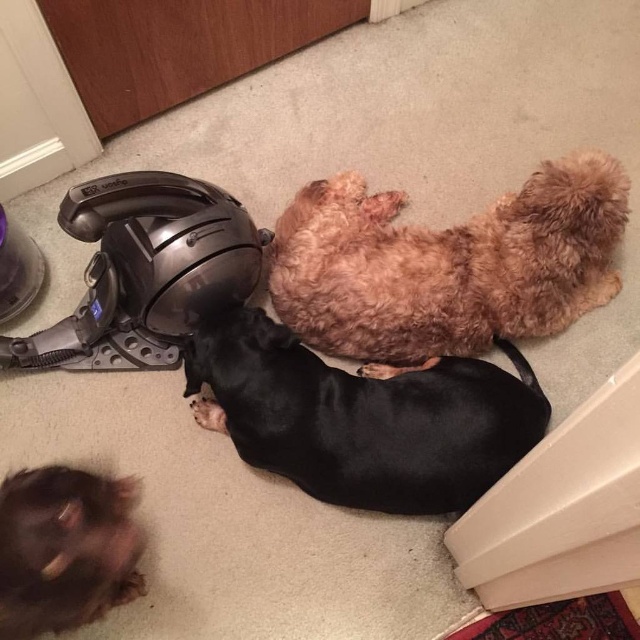
Is black smooth dog at center positioned at the back of brown fluffy dog at lower left?

That is True.

Is black smooth dog at center bigger than brown fluffy dog at lower left?

Yes, black smooth dog at center is bigger than brown fluffy dog at lower left.

Between point (275, 330) and point (35, 547), which one is positioned in front?

Point (35, 547) is in front.

You are a GUI agent. You are given a task and a screenshot of the screen. Output one action in this format:
    pyautogui.click(x=<x>, y=<y>)
    Task: Click on the black smooth dog at center
    The height and width of the screenshot is (640, 640).
    Given the screenshot: What is the action you would take?
    pyautogui.click(x=362, y=417)

Does brushed metal vacuum cleaner at center have a smaller size compared to brown fluffy dog at lower left?

No, brushed metal vacuum cleaner at center is not smaller than brown fluffy dog at lower left.

Which is behind, point (88, 352) or point (67, 589)?

The point (88, 352) is behind.

Find the location of `brushed metal vacuum cleaner at center`. brushed metal vacuum cleaner at center is located at coordinates (144, 272).

Who is positioned more to the left, fuzzy brown dog at center or brown fluffy dog at lower left?

brown fluffy dog at lower left is more to the left.

Is fuzzy brown dog at center shorter than brown fluffy dog at lower left?

No.

Between point (292, 227) and point (104, 605), which one is positioned behind?

The point (292, 227) is more distant.

You are a GUI agent. You are given a task and a screenshot of the screen. Output one action in this format:
    pyautogui.click(x=<x>, y=<y>)
    Task: Click on the fuzzy brown dog at center
    
    Given the screenshot: What is the action you would take?
    pyautogui.click(x=448, y=264)